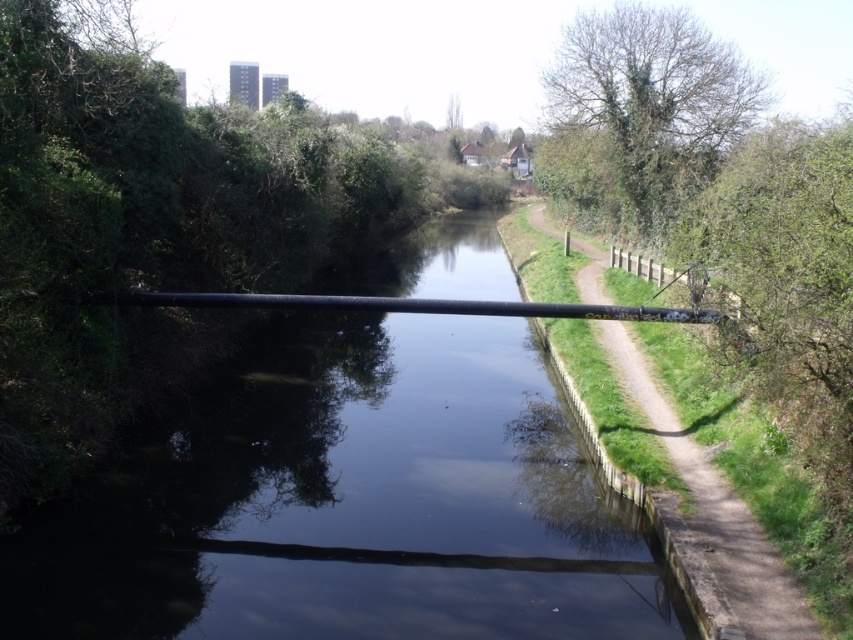
You are a drone operator trying to fly a drone with a height of 2 meters. You need to pass over the black pipe at center and the dirt path at right. Which object will the drone have to fly over first, and why?

The drone will have to fly over the black pipe at center first because it has a lesser height compared to the dirt path at right, so the drone must clear the pipe before reaching the higher elevation of the dirt path.

You are standing on the dirt path on the right bank of the canal. You want to cross to the other side. The black pipe at center is in your way. Can you walk around it on the path? Explain why or why not based on the scene description.

The black pipe at center is located at point (351,504) in the scene. Since the path is narrow and the pipe spans the entire canal, there is no space to walk around it on the path. You would need to go around the pipe by moving along the path either upstream or downstream to find a crossing point not blocked by the pipe.

You are a hiker standing on the dirt path at right. You want to take a photo of the green leafy tree at upper right. Which direction should you face to capture the tree in your camera view?

The green leafy tree at upper right is taller than the dirt path at right. Since you are on the dirt path at right, you should face towards the upper right direction to capture the tree in your camera view.